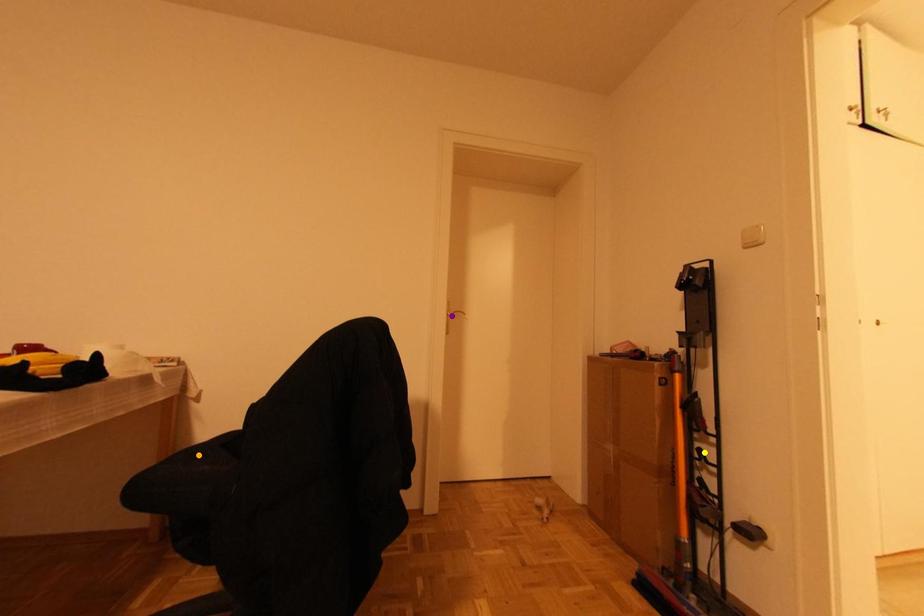
Order these from farthest to nearest:
orange point
purple point
yellow point

purple point
yellow point
orange point